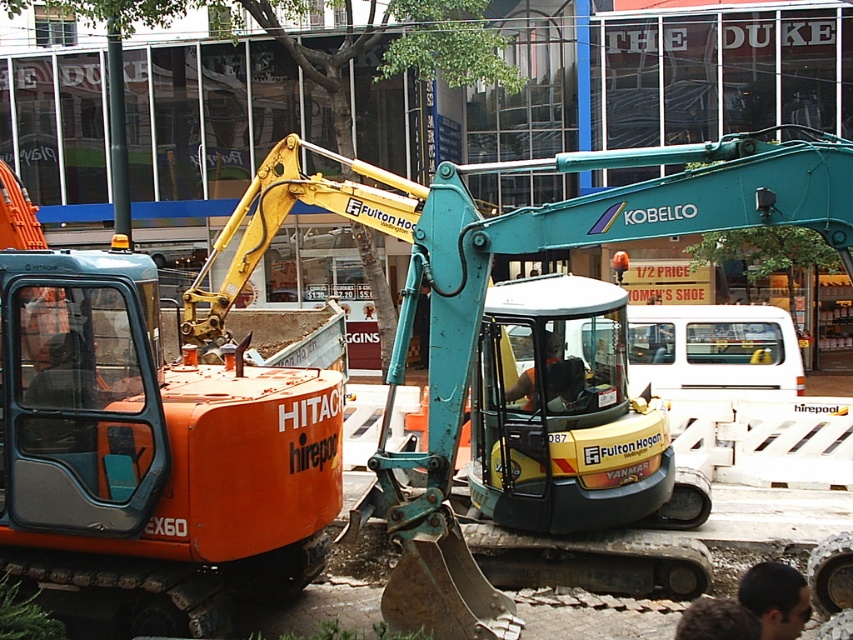
You are a worker who needs to place a safety vest on the ground between the teal metallic excavator at center and the orange fabric shirt at center. The vest requires a minimum of 5 feet of space to be properly secured. Can you safely place it there?

The distance between the teal metallic excavator at center and the orange fabric shirt at center is 6.32 feet, which is more than the required 5 feet. Therefore, you can safely place the safety vest between them.

You are standing at the point labeled point (775, 598) in the construction scene. What object is located at that point?

The point (775, 598) corresponds to the dark brown hair at lower right.

You are a construction worker standing at the edge of the street looking at the teal metallic excavator at center and the orange fabric shirt at center. Which object is nearer to you?

The teal metallic excavator at center is closer to the viewer than the orange fabric shirt at center.